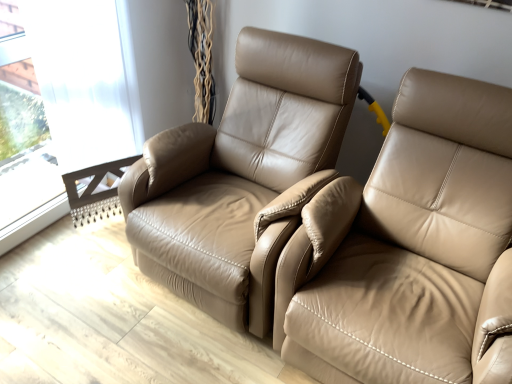
Question: From the image's perspective, is transparent glass window at upper left under tan leather chair at center?

Choices:
 (A) yes
 (B) no

Answer: (B)

Question: Is there a large distance between transparent glass window at upper left and tan leather chair at center?

Choices:
 (A) yes
 (B) no

Answer: (B)

Question: Can you confirm if transparent glass window at upper left is taller than tan leather chair at center?

Choices:
 (A) yes
 (B) no

Answer: (A)

Question: Does transparent glass window at upper left appear on the right side of tan leather chair at center?

Choices:
 (A) no
 (B) yes

Answer: (A)

Question: Is transparent glass window at upper left beside tan leather chair at center?

Choices:
 (A) no
 (B) yes

Answer: (A)

Question: Does transparent glass window at upper left appear on the left side of tan leather chair at center?

Choices:
 (A) no
 (B) yes

Answer: (B)

Question: Considering the relative sizes of tan leather chair at center and beige leather recliner at right in the image provided, is tan leather chair at center bigger than beige leather recliner at right?

Choices:
 (A) no
 (B) yes

Answer: (A)

Question: From the image's perspective, is tan leather chair at center over beige leather recliner at right?

Choices:
 (A) no
 (B) yes

Answer: (B)

Question: Is tan leather chair at center oriented towards beige leather recliner at right?

Choices:
 (A) yes
 (B) no

Answer: (B)

Question: Is tan leather chair at center closer to camera compared to beige leather recliner at right?

Choices:
 (A) no
 (B) yes

Answer: (A)

Question: Is tan leather chair at center further to the viewer compared to beige leather recliner at right?

Choices:
 (A) yes
 (B) no

Answer: (A)

Question: Can you confirm if tan leather chair at center is positioned to the left of beige leather recliner at right?

Choices:
 (A) no
 (B) yes

Answer: (B)

Question: Is the surface of beige leather recliner at right in direct contact with transparent glass window at upper left?

Choices:
 (A) yes
 (B) no

Answer: (B)